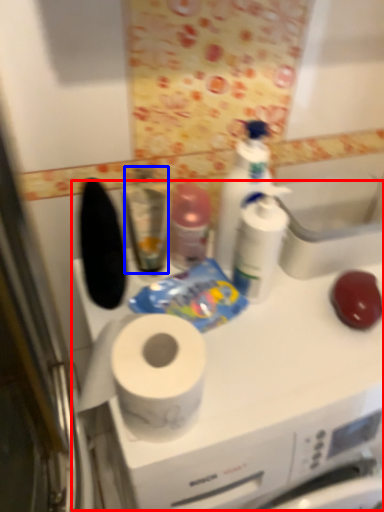
Question: Which of the following is the closest to the observer, counter (highlighted by a red box) or mouthwash (highlighted by a blue box)?

Choices:
 (A) counter
 (B) mouthwash

Answer: (A)